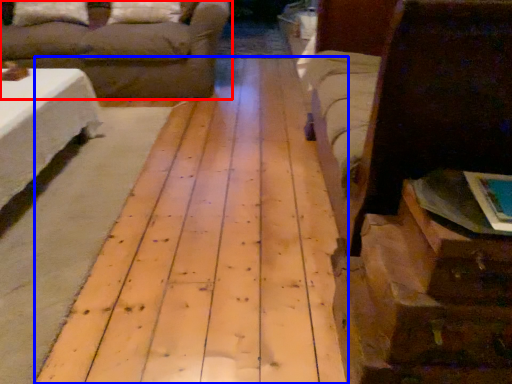
Question: Among these objects, which one is farthest to the camera, studio couch (highlighted by a red box) or plywood (highlighted by a blue box)?

Choices:
 (A) studio couch
 (B) plywood

Answer: (A)